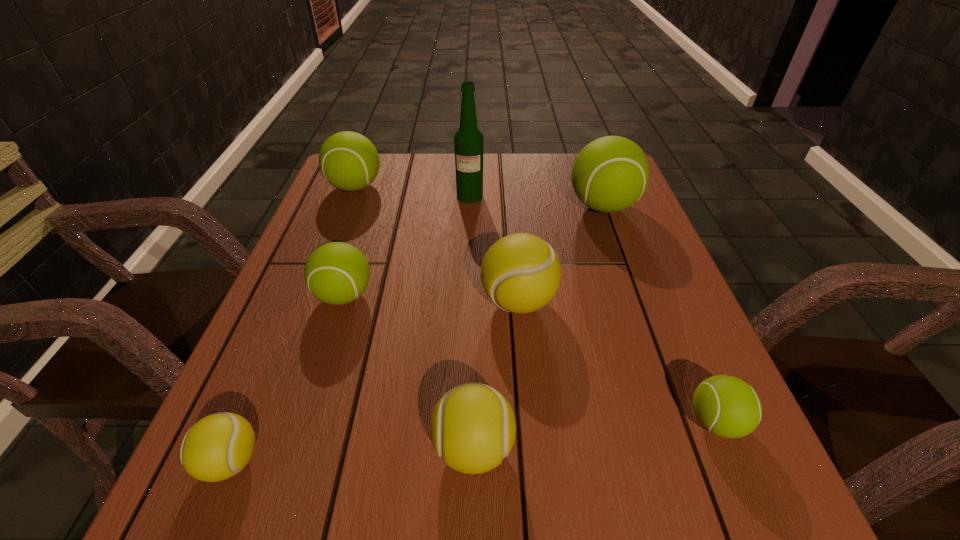
Select which yellow tennis ball appears as the closest to the tallest tennis ball. Please provide its 2D coordinates. Your answer should be formatted as a tuple, i.e. [(x, y)], where the tuple contains the x and y coordinates of a point satisfying the conditions above.

[(521, 273)]

At what (x,y) coordinates should I click in order to perform the action: click on yellow tennis ball that is the closest to the tallest tennis ball. Please return your answer as a coordinate pair (x, y). Looking at the image, I should click on (521, 273).

Locate an element on the screen. This screenshot has width=960, height=540. blank space that satisfies the following two spatial constraints: 1. on the back side of the second biggest yellow tennis ball; 2. on the right side of the second tallest object is located at coordinates (476, 206).